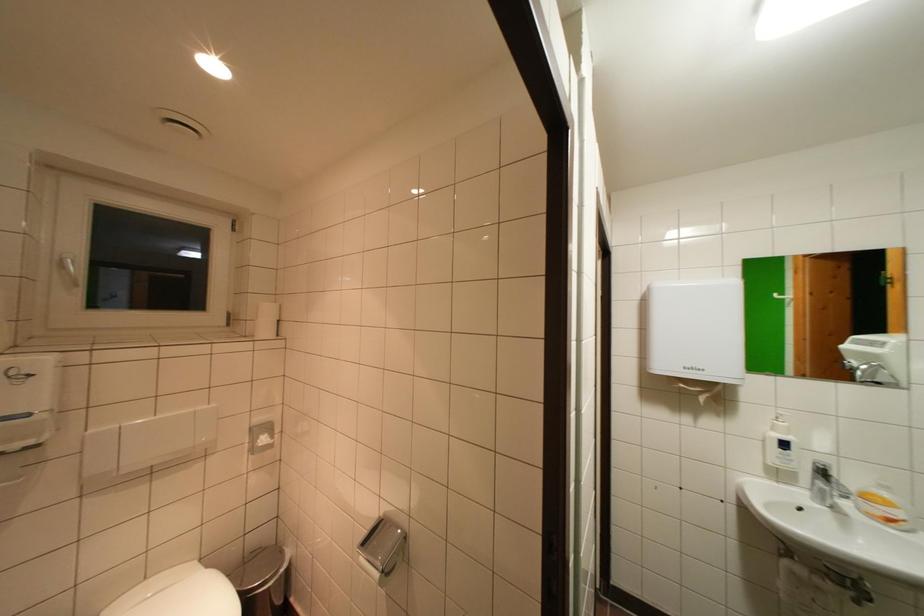
Identify the location of metal toilet roll cover. (383, 545).